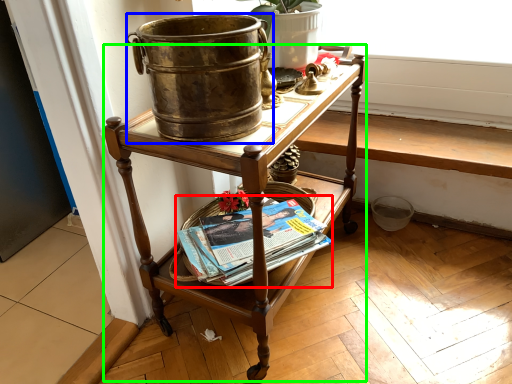
Question: Which object is positioned closest to paperback book (highlighted by a red box)? Select from flowerpot (highlighted by a blue box) and desk (highlighted by a green box).

Choices:
 (A) flowerpot
 (B) desk

Answer: (B)